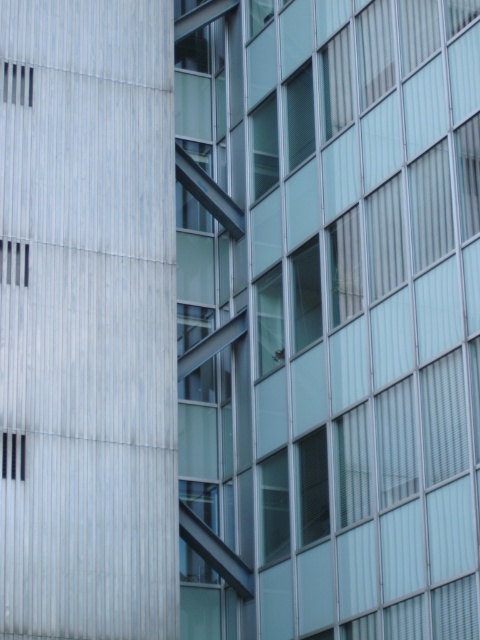
You are standing in front of the modern building facade. There are two points marked on the building. The first point is at coordinates point [206,317] and the second point is at point [1,250]. Which point is closer to you?

Point [1,250] is closer to you because it is in front of point [206,317].

You are a maintenance worker needing to inspect two components on a building facade. You have a ladder that can reach up to 30 feet. The components are the transparent glass window at center and the metallic silver vent at upper left. Can you safely inspect both components with your current ladder without moving it?

The transparent glass window at center and the metallic silver vent at upper left are 36.05 feet apart from each other. Since the ladder can only reach up to 30 feet, you cannot safely inspect both components without moving the ladder because the distance between them exceeds the ladder length.

You are standing at the base of the building and want to know how far the point at coordinates point (357, 336) is from you. Can you determine the distance?

The point at coordinates point (357, 336) is 158.82 feet away from you.